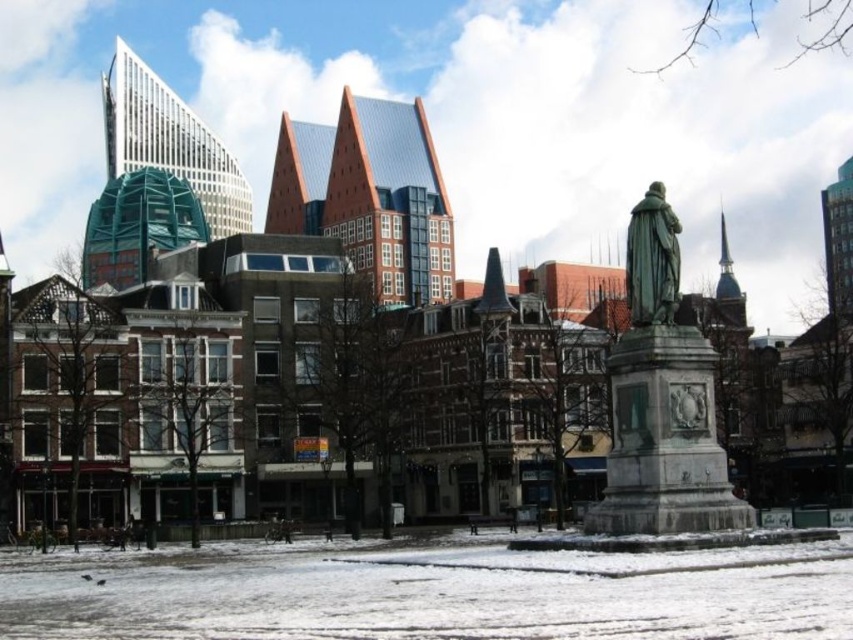
Question: Can you confirm if white powdery snow at lower center is bigger than green polished stone statue at center?

Choices:
 (A) no
 (B) yes

Answer: (A)

Question: Among these points, which one is nearest to the camera?

Choices:
 (A) (314, 557)
 (B) (669, 321)
 (C) (650, 182)

Answer: (B)

Question: Does white powdery snow at lower center appear under green polished stone statue at center?

Choices:
 (A) no
 (B) yes

Answer: (B)

Question: Estimate the real-world distances between objects in this image. Which object is farther from the bronze statue at center?

Choices:
 (A) white powdery snow at lower center
 (B) green polished stone statue at center

Answer: (A)

Question: Which object is the farthest from the green polished stone statue at center?

Choices:
 (A) white powdery snow at lower center
 (B) bronze statue at center

Answer: (A)

Question: Can you confirm if white powdery snow at lower center is positioned below bronze statue at center?

Choices:
 (A) no
 (B) yes

Answer: (B)